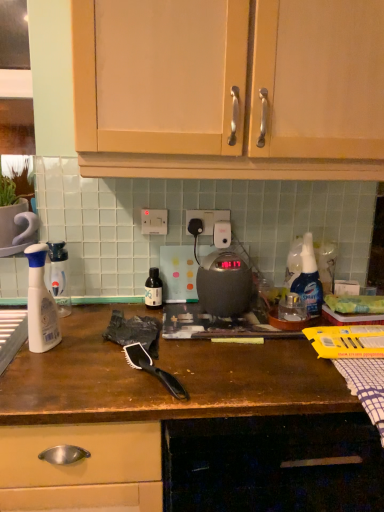
Question: Considering the relative sizes of translucent plastic spray bottle at left and white plastic electric outlet at center, arranged as the 2th electric outlet when viewed from the left, in the image provided, is translucent plastic spray bottle at left bigger than white plastic electric outlet at center, arranged as the 2th electric outlet when viewed from the left,?

Choices:
 (A) no
 (B) yes

Answer: (B)

Question: Considering the relative positions of translucent plastic spray bottle at left and white plastic electric outlet at center, arranged as the 2th electric outlet when viewed from the left, in the image provided, is translucent plastic spray bottle at left to the right of white plastic electric outlet at center, arranged as the 2th electric outlet when viewed from the left, from the viewer's perspective?

Choices:
 (A) yes
 (B) no

Answer: (B)

Question: Is translucent plastic spray bottle at left oriented away from white plastic electric outlet at center, the first electric outlet when ordered from right to left?

Choices:
 (A) yes
 (B) no

Answer: (B)

Question: Does translucent plastic spray bottle at left touch white plastic electric outlet at center, arranged as the 2th electric outlet when viewed from the left?

Choices:
 (A) yes
 (B) no

Answer: (B)

Question: Is translucent plastic spray bottle at left positioned in front of white plastic electric outlet at center, the first electric outlet when ordered from right to left?

Choices:
 (A) yes
 (B) no

Answer: (A)

Question: Considering the relative sizes of translucent plastic spray bottle at left and white plastic electric outlet at center, arranged as the 2th electric outlet when viewed from the left, in the image provided, is translucent plastic spray bottle at left shorter than white plastic electric outlet at center, arranged as the 2th electric outlet when viewed from the left,?

Choices:
 (A) yes
 (B) no

Answer: (B)

Question: Considering the relative positions of brown matte countertop at center, the 1th cabinetry ordered from the bottom, and translucent plastic spray bottle at right in the image provided, is brown matte countertop at center, the 1th cabinetry ordered from the bottom, to the left of translucent plastic spray bottle at right from the viewer's perspective?

Choices:
 (A) no
 (B) yes

Answer: (B)

Question: Is brown matte countertop at center, the 1th cabinetry ordered from the bottom, positioned with its back to translucent plastic spray bottle at right?

Choices:
 (A) no
 (B) yes

Answer: (A)

Question: Is brown matte countertop at center, which appears as the second cabinetry when viewed from the top, far away from translucent plastic spray bottle at right?

Choices:
 (A) no
 (B) yes

Answer: (A)

Question: From a real-world perspective, is brown matte countertop at center, the 1th cabinetry ordered from the bottom, on top of translucent plastic spray bottle at right?

Choices:
 (A) yes
 (B) no

Answer: (B)

Question: Could you tell me if brown matte countertop at center, which appears as the second cabinetry when viewed from the top, is turned towards translucent plastic spray bottle at right?

Choices:
 (A) yes
 (B) no

Answer: (B)

Question: Can you confirm if brown matte countertop at center, which appears as the second cabinetry when viewed from the top, is taller than translucent plastic spray bottle at right?

Choices:
 (A) no
 (B) yes

Answer: (B)

Question: Can you confirm if white plastic electric outlet at center, arranged as the 2th electric outlet when viewed from the left, is smaller than brown matte countertop at center, the 1th cabinetry ordered from the bottom?

Choices:
 (A) yes
 (B) no

Answer: (A)